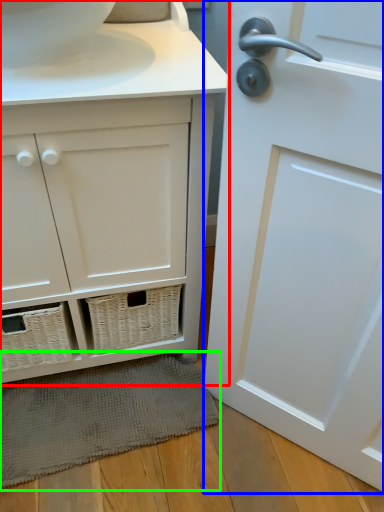
Question: Which object is the closest to the bathroom cabinet (highlighted by a red box)? Choose among these: door (highlighted by a blue box) or bath mat (highlighted by a green box).

Choices:
 (A) door
 (B) bath mat

Answer: (A)